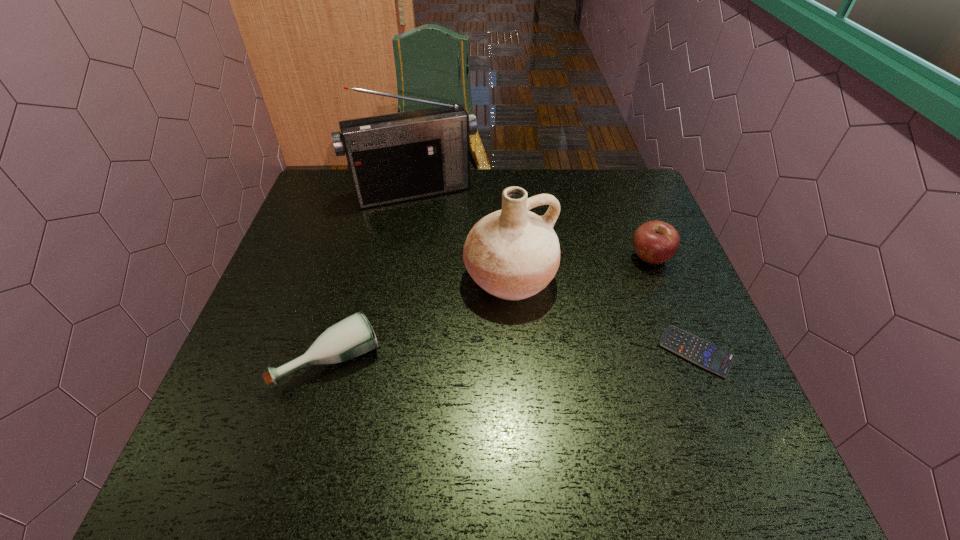
You are a GUI agent. You are given a task and a screenshot of the screen. Output one action in this format:
    pyautogui.click(x=<x>, y=<y>)
    Task: Click on the vacant space on the desktop that is between the bottle and the calculator and is positioned on the front-facing side of the radio receiver
    
    Given the screenshot: What is the action you would take?
    pyautogui.click(x=476, y=356)

At what (x,y) coordinates should I click in order to perform the action: click on vacant spot on the desktop that is between the bottle and the calculator and is positioned to pour from the handle of the fourth shortest object. Please return your answer as a coordinate pair (x, y). This screenshot has width=960, height=540. Looking at the image, I should click on (561, 354).

Locate an element on the screen. vacant spot on the desktop that is between the bottle and the shortest object and is positioned on the side of the apple with the unique marking is located at coordinates (461, 357).